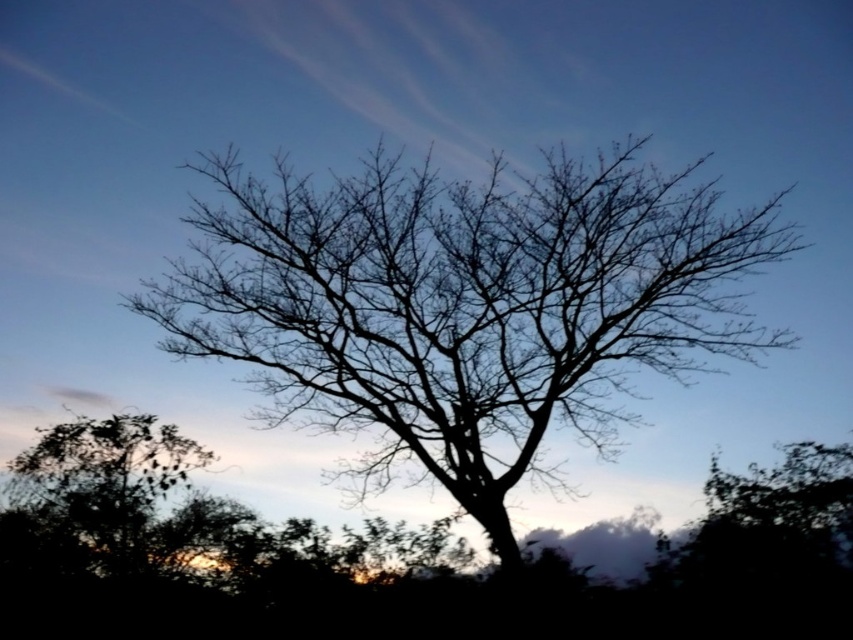
You are an artist trying to draw the scene. You need to decide which tree to focus on first based on their sizes. Which tree should you draw first, the silhouette bark tree at center or the green leafy tree at lower left?

The silhouette bark tree at center is larger in size than the green leafy tree at lower left, so you should draw the silhouette bark tree at center first as it takes up more space in the composition.

You are an artist trying to paint the scene. You want to ensure that the silhouette bark tree at center and the green leafy tree at lower left are proportionate. Based on the image, which tree should you make wider in your painting?

The silhouette bark tree at center should be made wider in the painting since it might be wider than the green leafy tree at lower left according to the description.